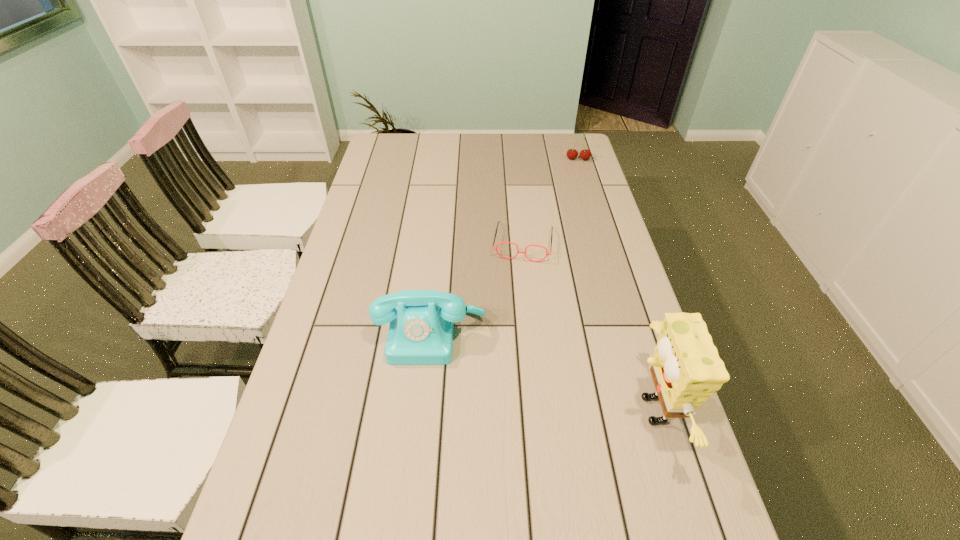
Identify the location of free space located 0.110m on the front-facing side of the tallest object. The height and width of the screenshot is (540, 960). (577, 410).

Find the location of `free spot located 0.170m on the front-facing side of the third object from right to left`. free spot located 0.170m on the front-facing side of the third object from right to left is located at coordinates (x=515, y=304).

Where is `free region located on the front-facing side of the third object from right to left`? Image resolution: width=960 pixels, height=540 pixels. free region located on the front-facing side of the third object from right to left is located at coordinates (516, 299).

Locate an element on the screen. This screenshot has height=540, width=960. vacant space located 0.310m on the front-facing side of the third object from right to left is located at coordinates (510, 345).

Where is `free space located on the surface of the cherry`? The height and width of the screenshot is (540, 960). free space located on the surface of the cherry is located at coordinates (574, 208).

Where is `free space located 0.400m on the surface of the cherry`? free space located 0.400m on the surface of the cherry is located at coordinates (573, 224).

Where is `free space located on the surface of the cherry`? The height and width of the screenshot is (540, 960). free space located on the surface of the cherry is located at coordinates (574, 208).

Where is `object that is positioned at the far edge`? object that is positioned at the far edge is located at coordinates (585, 154).

This screenshot has width=960, height=540. In order to click on sponge located at the right edge in this screenshot , I will do `click(686, 369)`.

Where is `cherry situated at the right edge`? cherry situated at the right edge is located at coordinates (585, 154).